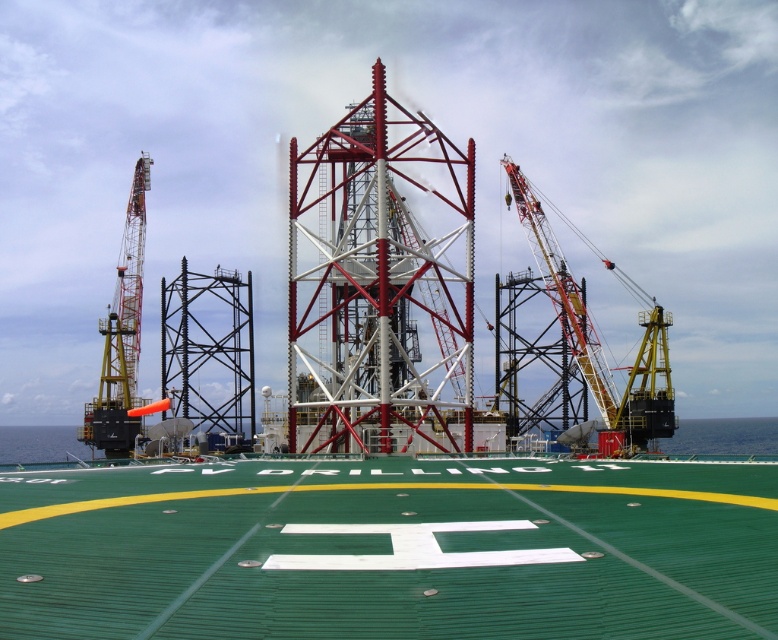
Based on the photo, you are a technician on an offshore drilling platform. You need to move a 150 feet long equipment from the yellow painted metal crane at left to the metallic red and white tower at center. Can you safely transport it without bending the equipment? Please explain your reasoning.

The metallic red and white tower at center and yellow painted metal crane at left are 186.63 feet apart from each other. Since the equipment is 150 feet long, it can be transported safely as the distance between them is greater than the equipment length, allowing enough space for movement without bending.

What are the coordinates of the orange painted metal crane at right?

The orange painted metal crane at right is located at coordinates (562, 292).